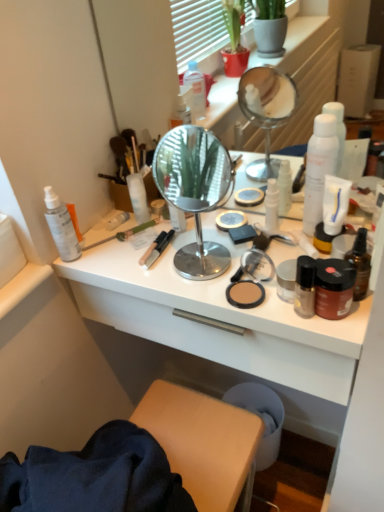
The image size is (384, 512). I want to click on vacant area that lies between white matte spray can at left, the seventh toiletry in the right-to-left sequence, and brown matte jar at right, which is the seventh toiletry from left to right, so click(169, 272).